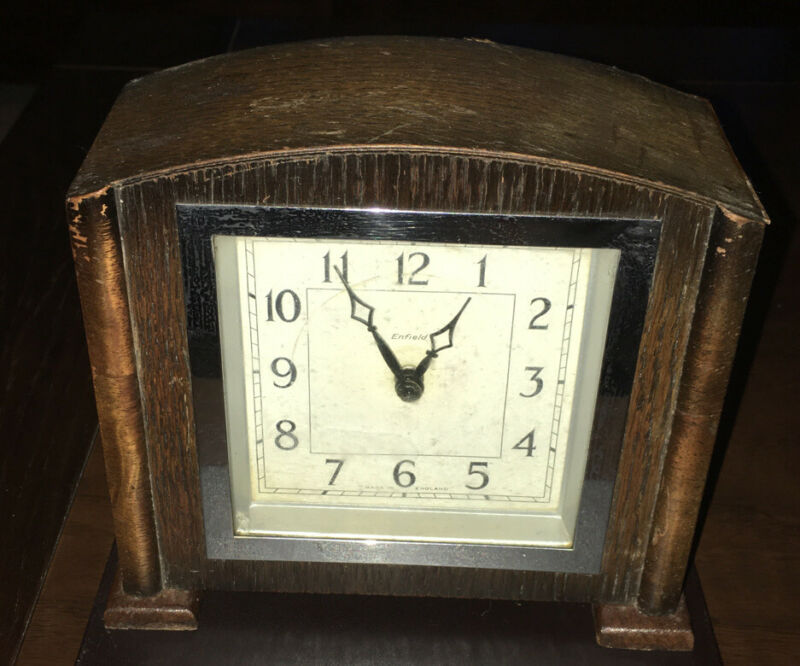
Identify the location of hands of the clock. The width and height of the screenshot is (800, 666). (360, 312), (452, 335).